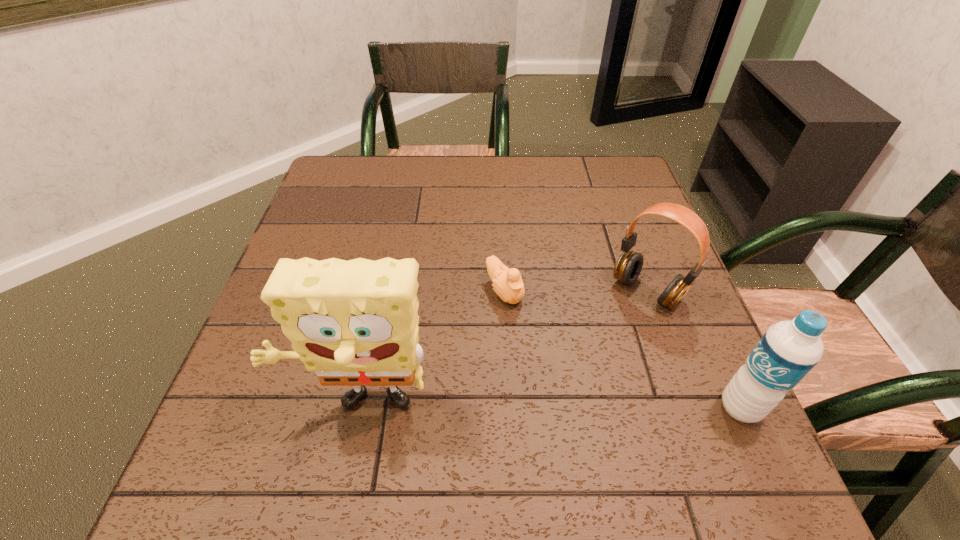
What are the coordinates of `object that stands as the third closest to the water bottle` in the screenshot? It's located at (355, 323).

Locate an element on the screen. free spot that satisfies the following two spatial constraints: 1. on the face of the leftmost object; 2. on the label of the water bottle is located at coordinates (360, 408).

This screenshot has width=960, height=540. Find the location of `free point that satisfies the following two spatial constraints: 1. on the front side of the second shortest object; 2. on the label of the water bottle`. free point that satisfies the following two spatial constraints: 1. on the front side of the second shortest object; 2. on the label of the water bottle is located at coordinates (688, 408).

What are the coordinates of `free space that satisfies the following two spatial constraints: 1. on the face of the sponge; 2. on the label of the water bottle` in the screenshot? It's located at (360, 408).

Identify the location of free space that satisfies the following two spatial constraints: 1. on the front side of the water bottle; 2. on the label of the headset. (688, 408).